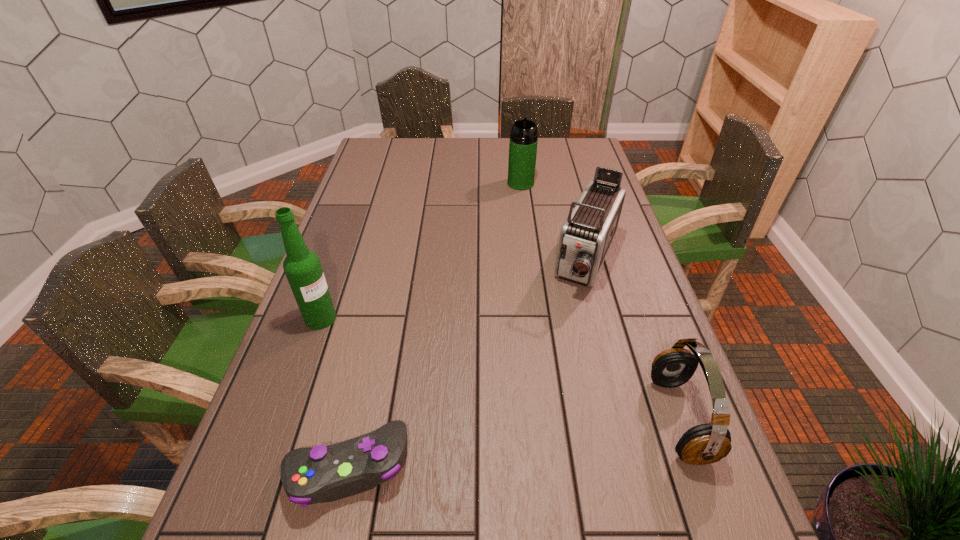
The width and height of the screenshot is (960, 540). I want to click on object that is the fourth nearest to the second shortest object, so click(523, 139).

Where is `object that is the fourth nearest to the shortest object`? object that is the fourth nearest to the shortest object is located at coordinates (523, 139).

What are the coordinates of `free location that satisfies the following two spatial constraints: 1. on the front side of the second shortest object; 2. on the ear cups of the camcorder` in the screenshot? It's located at (630, 418).

Where is `free space that satisfies the following two spatial constraints: 1. on the front side of the camcorder; 2. on the ear cups of the second shortest object`? Image resolution: width=960 pixels, height=540 pixels. free space that satisfies the following two spatial constraints: 1. on the front side of the camcorder; 2. on the ear cups of the second shortest object is located at coordinates (630, 418).